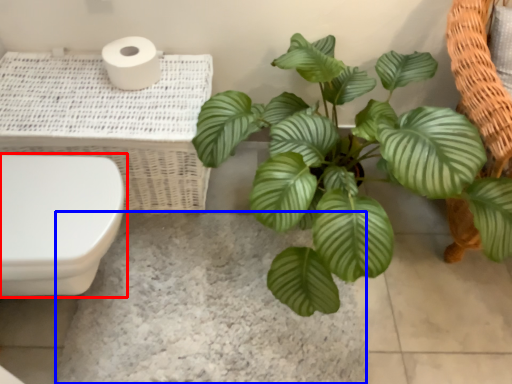
Question: Which of the following is the closest to the observer, toilet (highlighted by a red box) or concrete (highlighted by a blue box)?

Choices:
 (A) toilet
 (B) concrete

Answer: (A)